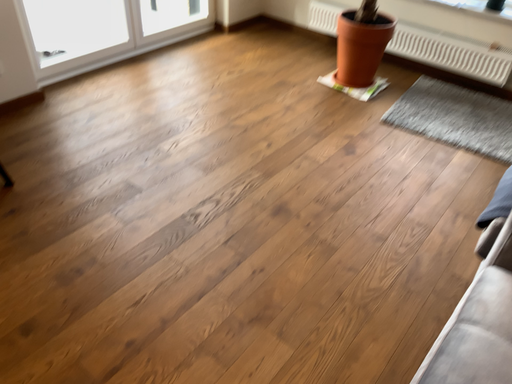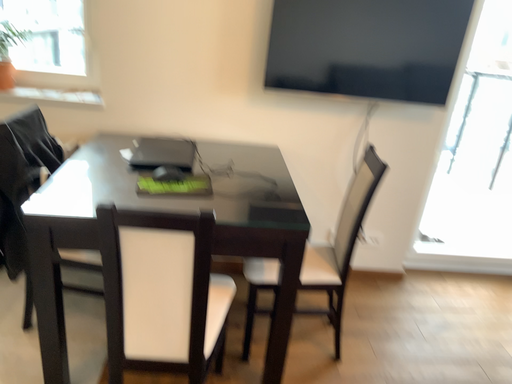
Question: How did the camera likely rotate when shooting the video?

Choices:
 (A) rotated downward
 (B) rotated upward

Answer: (B)